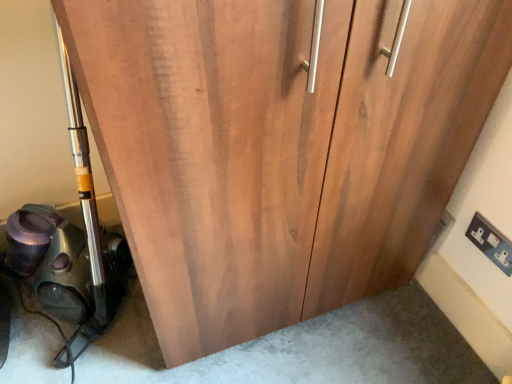
What do you see at coordinates (490, 242) in the screenshot?
I see `white plastic electric outlet at lower right` at bounding box center [490, 242].

This screenshot has height=384, width=512. I want to click on white plastic electric outlet at lower right, so click(490, 242).

What is the approximate width of metallic vacuum cleaner at left?

The width of metallic vacuum cleaner at left is 56.71 centimeters.

Measure the distance between metallic vacuum cleaner at left and camera.

metallic vacuum cleaner at left and camera are 35.28 inches apart.

In order to click on metallic vacuum cleaner at left in this screenshot , I will do `click(70, 246)`.

Image resolution: width=512 pixels, height=384 pixels. What do you see at coordinates (70, 246) in the screenshot?
I see `metallic vacuum cleaner at left` at bounding box center [70, 246].

This screenshot has width=512, height=384. What are the coordinates of `white plastic electric outlet at lower right` in the screenshot? It's located at (490, 242).

Does metallic vacuum cleaner at left appear on the right side of white plastic electric outlet at lower right?

In fact, metallic vacuum cleaner at left is to the left of white plastic electric outlet at lower right.

Considering the positions of objects metallic vacuum cleaner at left and white plastic electric outlet at lower right in the image provided, who is behind, metallic vacuum cleaner at left or white plastic electric outlet at lower right?

white plastic electric outlet at lower right is further from the camera.

Is point (92, 210) farther from camera compared to point (495, 261)?

Yes, point (92, 210) is farther from viewer.

From the image's perspective, does metallic vacuum cleaner at left appear lower than white plastic electric outlet at lower right?

No, from the image's perspective, metallic vacuum cleaner at left is not below white plastic electric outlet at lower right.

From a real-world perspective, who is located lower, metallic vacuum cleaner at left or white plastic electric outlet at lower right?

white plastic electric outlet at lower right.

Considering the sizes of metallic vacuum cleaner at left and white plastic electric outlet at lower right in the image, is metallic vacuum cleaner at left wider or thinner than white plastic electric outlet at lower right?

Clearly, metallic vacuum cleaner at left has more width compared to white plastic electric outlet at lower right.

In terms of height, does metallic vacuum cleaner at left look taller or shorter compared to white plastic electric outlet at lower right?

metallic vacuum cleaner at left is taller than white plastic electric outlet at lower right.

Considering the sizes of objects metallic vacuum cleaner at left and white plastic electric outlet at lower right in the image provided, who is smaller, metallic vacuum cleaner at left or white plastic electric outlet at lower right?

With smaller size is white plastic electric outlet at lower right.

Which is correct: metallic vacuum cleaner at left is inside white plastic electric outlet at lower right, or outside of it?

metallic vacuum cleaner at left is not inside white plastic electric outlet at lower right, it's outside.

Is metallic vacuum cleaner at left in contact with white plastic electric outlet at lower right?

They are not placed beside each other.

Could you tell me if metallic vacuum cleaner at left is facing white plastic electric outlet at lower right?

No.

Image resolution: width=512 pixels, height=384 pixels. Find the location of `electric outlet behind the metallic vacuum cleaner at left`. electric outlet behind the metallic vacuum cleaner at left is located at coordinates (490, 242).

Can you confirm if white plastic electric outlet at lower right is positioned to the left of metallic vacuum cleaner at left?

Incorrect, white plastic electric outlet at lower right is not on the left side of metallic vacuum cleaner at left.

Considering their positions, is white plastic electric outlet at lower right located in front of or behind metallic vacuum cleaner at left?

In the image, white plastic electric outlet at lower right appears behind metallic vacuum cleaner at left.

Which point is more forward, (x=503, y=270) or (x=1, y=305)?

Positioned in front is point (x=503, y=270).

From the image's perspective, which object appears higher, white plastic electric outlet at lower right or metallic vacuum cleaner at left?

metallic vacuum cleaner at left.

From a real-world perspective, is white plastic electric outlet at lower right under metallic vacuum cleaner at left?

Indeed, from a real-world perspective, white plastic electric outlet at lower right is positioned beneath metallic vacuum cleaner at left.

Which of these two, white plastic electric outlet at lower right or metallic vacuum cleaner at left, is wider?

metallic vacuum cleaner at left.

Is white plastic electric outlet at lower right shorter than metallic vacuum cleaner at left?

Yes.

Who is bigger, white plastic electric outlet at lower right or metallic vacuum cleaner at left?

Bigger between the two is metallic vacuum cleaner at left.

Is metallic vacuum cleaner at left located within white plastic electric outlet at lower right?

Actually, metallic vacuum cleaner at left is outside white plastic electric outlet at lower right.

Is the surface of white plastic electric outlet at lower right in direct contact with metallic vacuum cleaner at left?

white plastic electric outlet at lower right and metallic vacuum cleaner at left are not in contact.

Is white plastic electric outlet at lower right facing towards metallic vacuum cleaner at left?

Yes, white plastic electric outlet at lower right faces towards metallic vacuum cleaner at left.

Can you tell me how much white plastic electric outlet at lower right and metallic vacuum cleaner at left differ in facing direction?

white plastic electric outlet at lower right and metallic vacuum cleaner at left are facing 89.7 degrees away from each other.

How distant is white plastic electric outlet at lower right from metallic vacuum cleaner at left?

A distance of 1.08 meters exists between white plastic electric outlet at lower right and metallic vacuum cleaner at left.

This screenshot has height=384, width=512. In order to click on electric outlet that is under the metallic vacuum cleaner at left (from a real-world perspective) in this screenshot , I will do `click(490, 242)`.

Identify the location of equipment in front of the white plastic electric outlet at lower right. (70, 246).

Locate an element on the screen. The image size is (512, 384). equipment above the white plastic electric outlet at lower right (from the image's perspective) is located at coordinates pos(70,246).